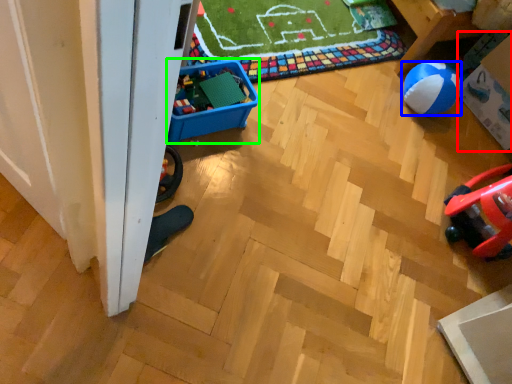
Question: Based on their relative distances, which object is farther from storage box (highlighted by a red box)? Choose from ball (highlighted by a blue box) and storage box (highlighted by a green box).

Choices:
 (A) ball
 (B) storage box

Answer: (B)